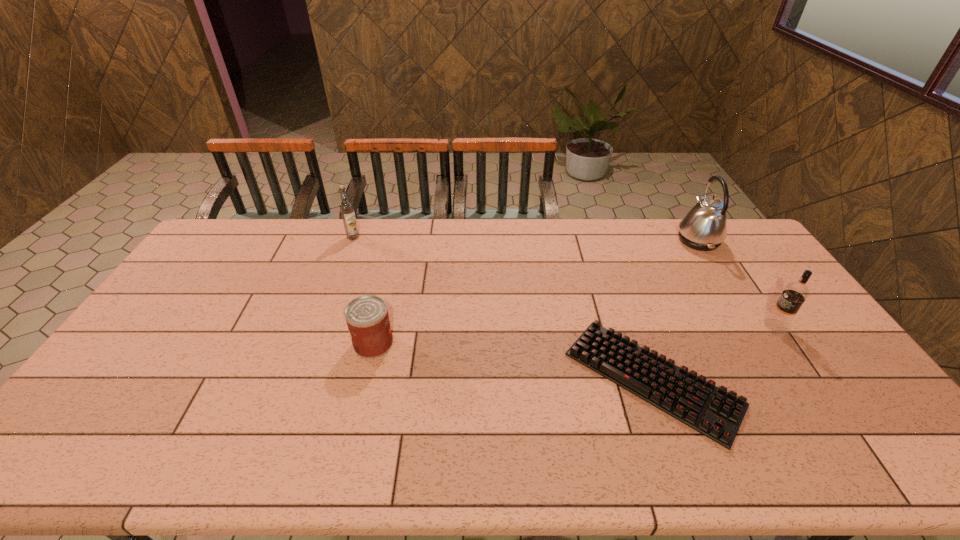
I want to click on object that is the second closest to the right vodka, so click(x=704, y=228).

I want to click on blank area in the image that satisfies the following two spatial constraints: 1. on the label of the farther vodka; 2. on the left side of the fourth tallest object, so click(314, 343).

This screenshot has height=540, width=960. What are the coordinates of `free spot that satisfies the following two spatial constraints: 1. on the label of the third object from left to right; 2. on the right side of the leftmost object` in the screenshot? It's located at click(x=300, y=379).

The width and height of the screenshot is (960, 540). Identify the location of free space that satisfies the following two spatial constraints: 1. on the label of the computer keyboard; 2. on the right side of the left vodka. (300, 379).

This screenshot has height=540, width=960. Identify the location of vacant area that satisfies the following two spatial constraints: 1. on the label of the computer keyboard; 2. on the left side of the leftmost object. (300, 379).